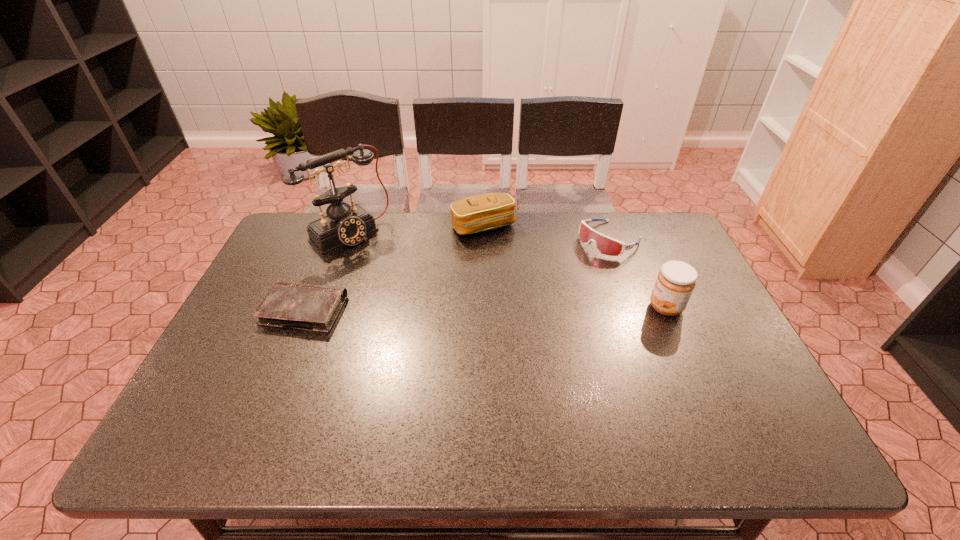
Locate an element on the screen. Image resolution: width=960 pixels, height=540 pixels. vacant area situated on the front-facing side of the goggles is located at coordinates (538, 287).

Identify the location of vacant region located on the front-facing side of the goggles. (533, 291).

The image size is (960, 540). I want to click on free spot located 0.390m on the front-facing side of the goggles, so click(x=500, y=313).

I want to click on vacant space located on the dial of the tallest object, so click(x=425, y=300).

In order to click on free space located 0.370m on the dial of the tallest object in this screenshot , I will do `click(441, 313)`.

Identify the location of vacant point located 0.390m on the dial of the tallest object. The width and height of the screenshot is (960, 540). (445, 318).

Identify the location of vacant space located on the zipper side of the third object from left to right. The width and height of the screenshot is (960, 540). (514, 276).

The height and width of the screenshot is (540, 960). In order to click on free region located on the zipper side of the third object from left to right in this screenshot , I will do `click(499, 249)`.

This screenshot has width=960, height=540. Identify the location of free spot located 0.360m on the zipper side of the third object from left to right. (539, 319).

Identify the location of goggles that is at the far edge. This screenshot has width=960, height=540. (605, 245).